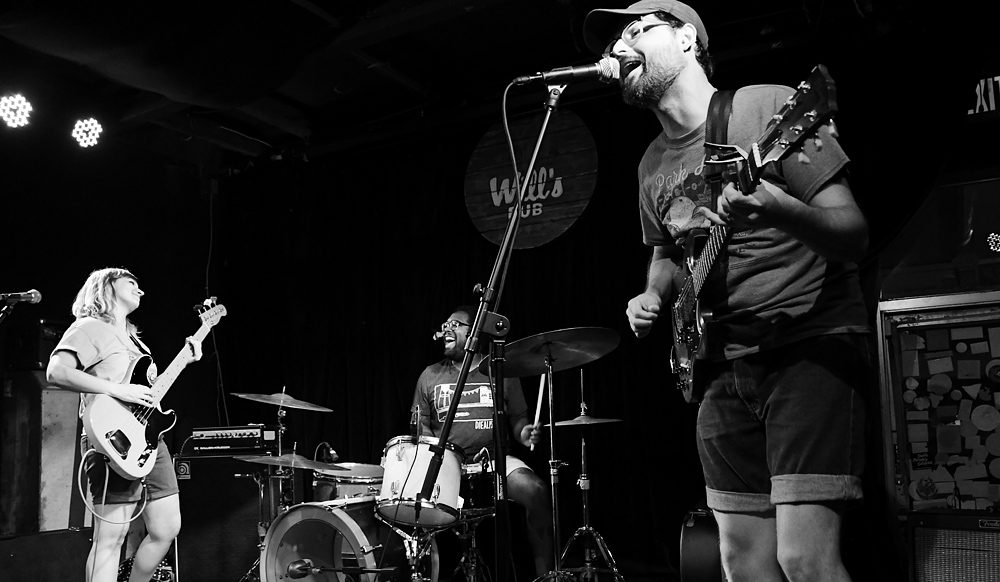
Find the location of a particular element. stickers is located at coordinates (949, 466), (969, 386).